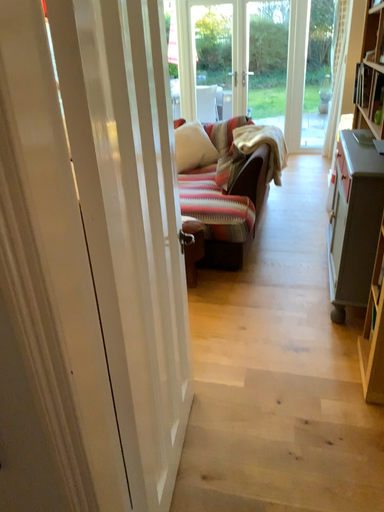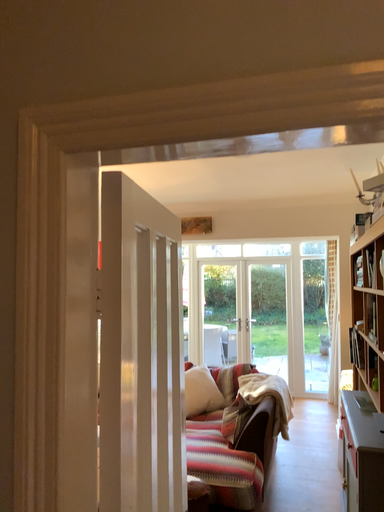
Question: Which way did the camera rotate in the video?

Choices:
 (A) rotated downward
 (B) rotated upward

Answer: (B)